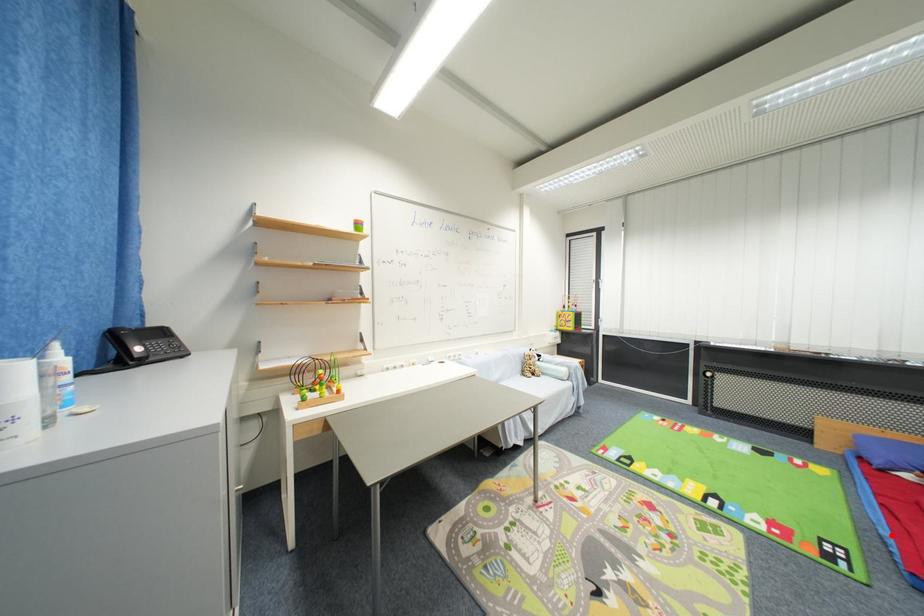
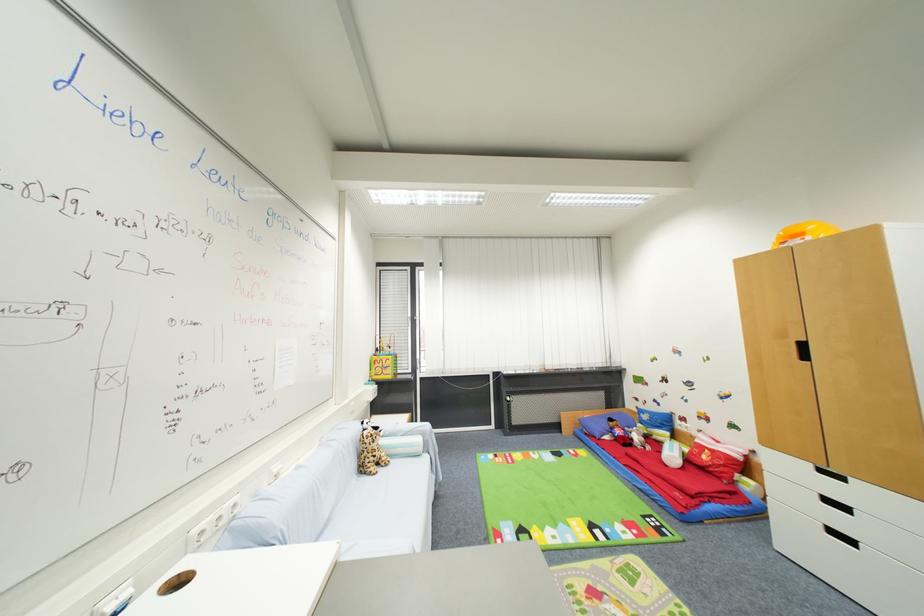
The point at the highlighted location is marked in the first image. Where is the corresponding point in the second image?

(650, 488)